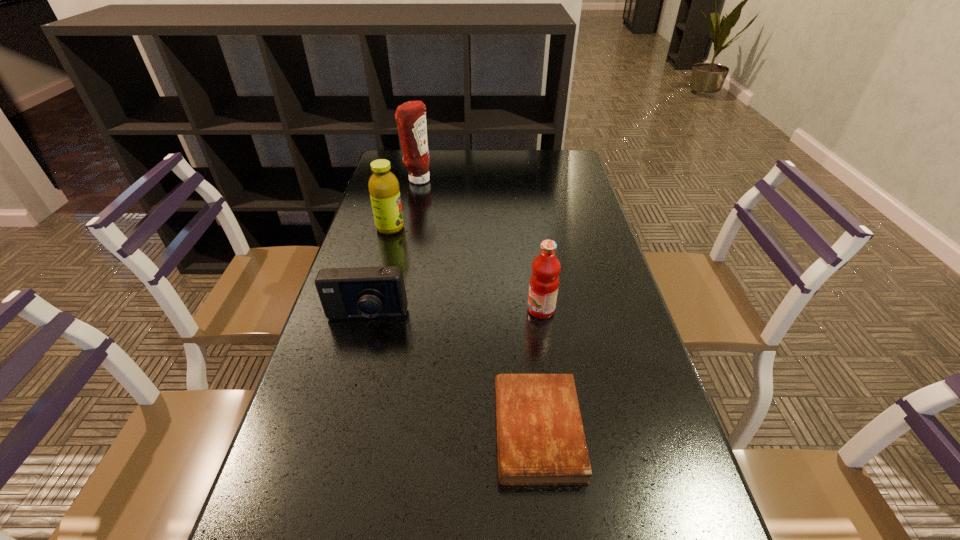
Locate an element on the screen. This screenshot has height=540, width=960. the tallest object is located at coordinates (411, 116).

Identify the location of the farthest object. This screenshot has width=960, height=540. (411, 116).

Find the location of a particular element. This screenshot has width=960, height=540. the left fruit juice is located at coordinates (383, 185).

This screenshot has width=960, height=540. What are the coordinates of `the farther fruit juice` in the screenshot? It's located at (383, 185).

Identify the location of the nearer fruit juice. This screenshot has width=960, height=540. (544, 281).

The height and width of the screenshot is (540, 960). What are the coordinates of `the second shortest object` in the screenshot? It's located at (364, 292).

I want to click on the nearest object, so click(x=540, y=438).

This screenshot has height=540, width=960. What are the coordinates of `Bible` in the screenshot? It's located at (540, 438).

Identify the location of free space located 0.090m on the back of the condiment. (421, 161).

Find the location of a particular element. blank area located on the front label of the second farthest object is located at coordinates (460, 228).